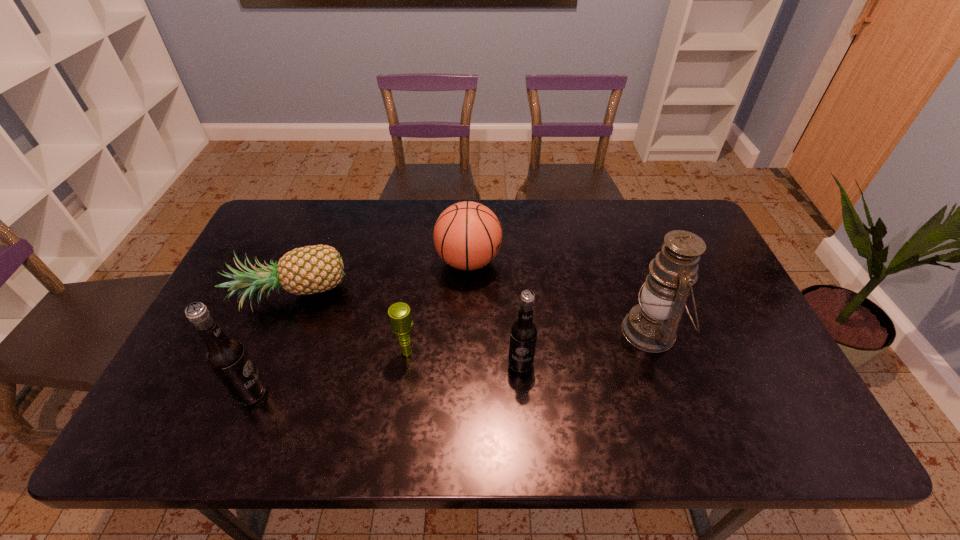
Please point a vacant point for placing a root beer on the right. Please provide its 2D coordinates. Your answer should be formatted as a tuple, i.e. [(x, y)], where the tuple contains the x and y coordinates of a point satisfying the conditions above.

[(763, 337)]